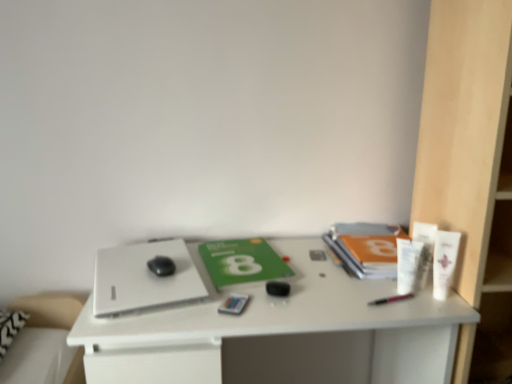
The image size is (512, 384). In order to click on free location in front of white plastic tube at right, the third toiletry positioned from the right in this screenshot , I will do [x=411, y=309].